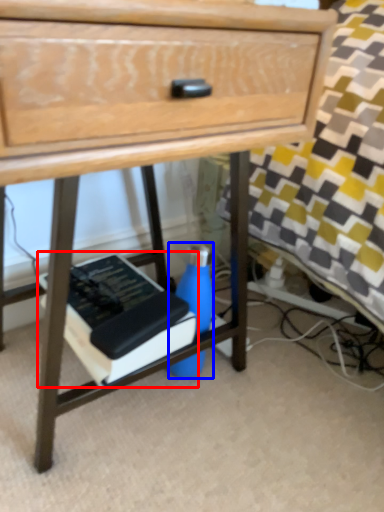
Question: Among these objects, which one is farthest to the camera, paperback book (highlighted by a red box) or bottle (highlighted by a blue box)?

Choices:
 (A) paperback book
 (B) bottle

Answer: (B)